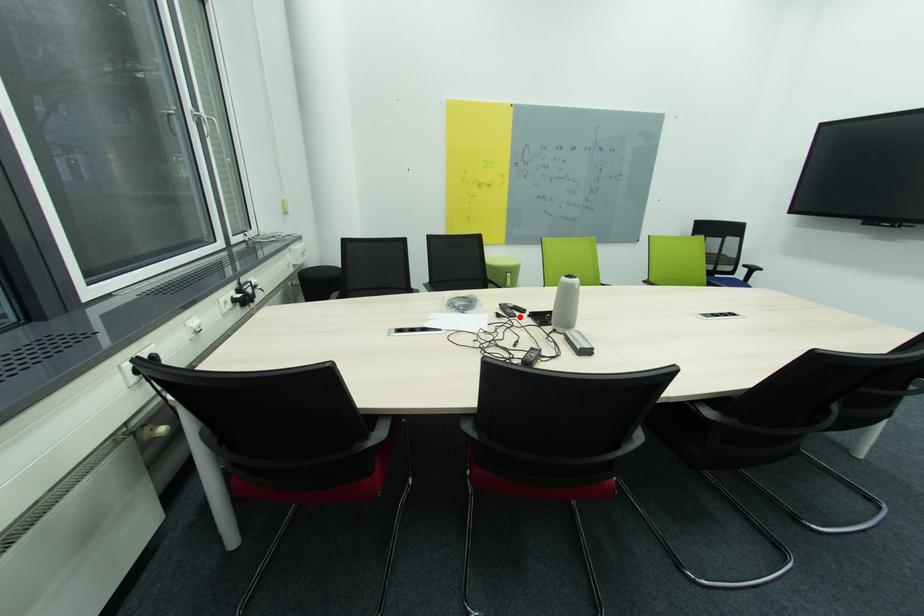
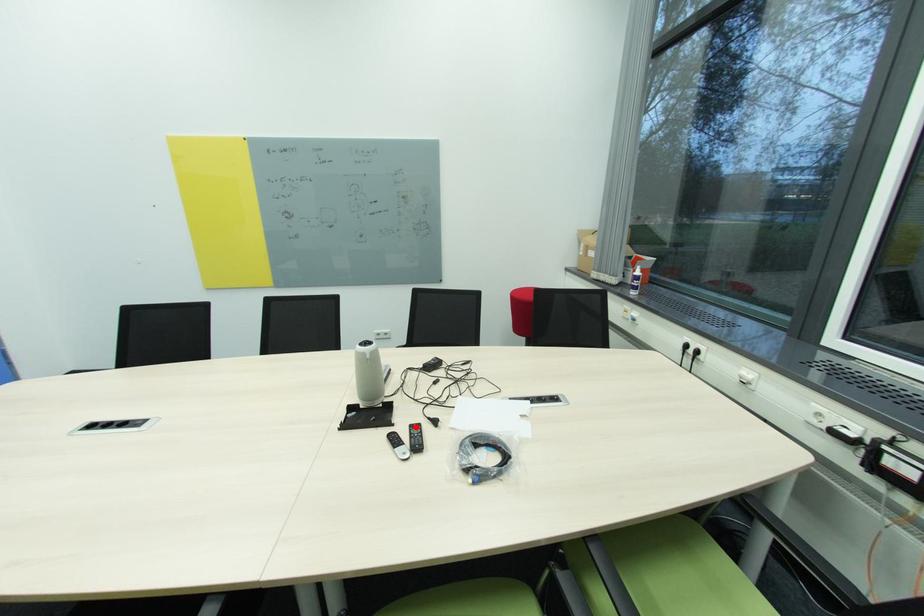
I am providing you with two images of the same scene from different viewpoints. A red point is marked on the first image and another point is marked on the second image. Does the point marked in image1 correspond to the same location as the one in image2?

Yes